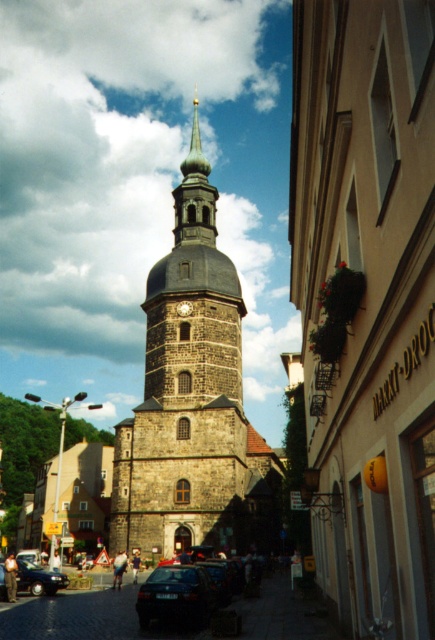
Question: Does dark blue matte car at lower center appear on the right side of smooth gray spire at center?

Choices:
 (A) no
 (B) yes

Answer: (B)

Question: Which object is closer to the camera taking this photo?

Choices:
 (A) smooth gray spire at center
 (B) dark gray stone tower at center
 (C) shiny black sedan at lower left
 (D) brown stone church at center

Answer: (D)

Question: Is dark blue matte car at lower center positioned in front of dark gray stone clock at center?

Choices:
 (A) no
 (B) yes

Answer: (B)

Question: Among these objects, which one is farthest from the camera?

Choices:
 (A) dark gray stone tower at center
 (B) smooth gray spire at center
 (C) dark gray stone clock at center

Answer: (B)

Question: Is dark blue matte car at lower center below dark gray stone clock at center?

Choices:
 (A) no
 (B) yes

Answer: (B)

Question: Which point is closer to the camera?

Choices:
 (A) dark blue matte car at lower center
 (B) brown stone church at center
 (C) shiny black sedan at lower left
 (D) dark gray stone clock at center

Answer: (B)